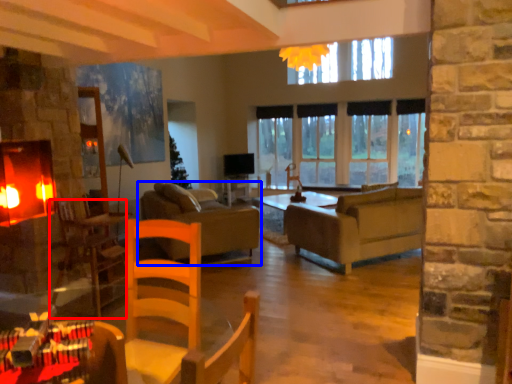
Question: Which object appears closest to the camera in this image, armchair (highlighted by a red box) or studio couch (highlighted by a blue box)?

Choices:
 (A) armchair
 (B) studio couch

Answer: (A)